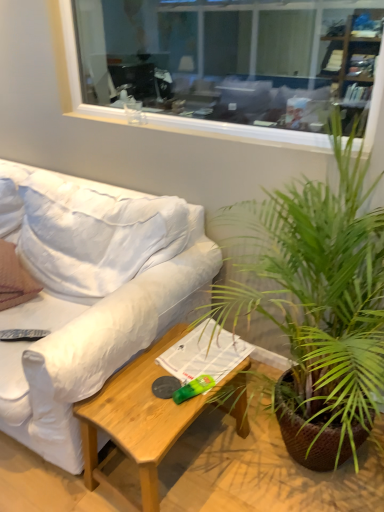
Question: Are light brown wood coffee table at lower center and white fabric couch at left making contact?

Choices:
 (A) yes
 (B) no

Answer: (B)

Question: Is light brown wood coffee table at lower center aimed at white fabric couch at left?

Choices:
 (A) yes
 (B) no

Answer: (B)

Question: From a real-world perspective, is light brown wood coffee table at lower center physically above white fabric couch at left?

Choices:
 (A) no
 (B) yes

Answer: (A)

Question: Is light brown wood coffee table at lower center positioned behind white fabric couch at left?

Choices:
 (A) yes
 (B) no

Answer: (A)

Question: Considering the relative sizes of light brown wood coffee table at lower center and white fabric couch at left in the image provided, is light brown wood coffee table at lower center taller than white fabric couch at left?

Choices:
 (A) yes
 (B) no

Answer: (B)

Question: Is brown textured pillow at left bigger or smaller than green leafy plant at center-right?

Choices:
 (A) small
 (B) big

Answer: (A)

Question: Is point (1, 292) closer or farther from the camera than point (294, 231)?

Choices:
 (A) closer
 (B) farther

Answer: (B)

Question: In the image, is brown textured pillow at left on the left side or the right side of green leafy plant at center-right?

Choices:
 (A) left
 (B) right

Answer: (A)

Question: Considering the positions of brown textured pillow at left and green leafy plant at center-right in the image, is brown textured pillow at left taller or shorter than green leafy plant at center-right?

Choices:
 (A) short
 (B) tall

Answer: (A)

Question: Considering their positions, is black plastic remote control at lower left located in front of or behind green leafy plant at center-right?

Choices:
 (A) front
 (B) behind

Answer: (B)

Question: In terms of height, does black plastic remote control at lower left look taller or shorter compared to green leafy plant at center-right?

Choices:
 (A) tall
 (B) short

Answer: (B)

Question: From a real-world perspective, is black plastic remote control at lower left positioned above or below green leafy plant at center-right?

Choices:
 (A) below
 (B) above

Answer: (A)

Question: Considering the positions of black plastic remote control at lower left and green leafy plant at center-right in the image, is black plastic remote control at lower left bigger or smaller than green leafy plant at center-right?

Choices:
 (A) big
 (B) small

Answer: (B)

Question: Considering the positions of brown textured pillow at left and white fabric couch at left in the image, is brown textured pillow at left wider or thinner than white fabric couch at left?

Choices:
 (A) thin
 (B) wide

Answer: (A)

Question: Is point (x=9, y=250) positioned closer to the camera than point (x=69, y=178)?

Choices:
 (A) farther
 (B) closer

Answer: (B)